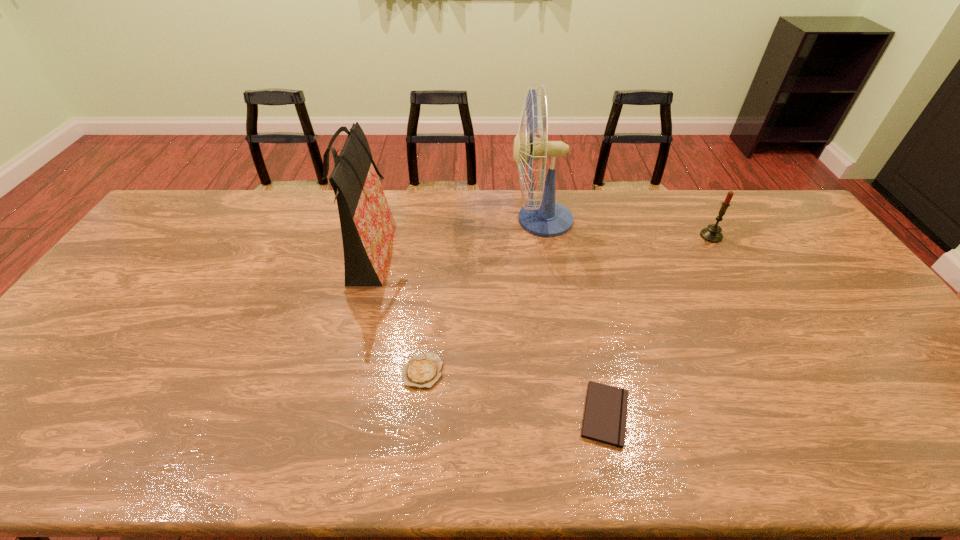
This screenshot has width=960, height=540. In order to click on unoccupied position between the rightmost object and the fan in this screenshot , I will do `click(626, 228)`.

Select which object is the second closest to the candle. Please provide its 2D coordinates. Your answer should be formatted as a tuple, i.e. [(x, y)], where the tuple contains the x and y coordinates of a point satisfying the conditions above.

[(605, 415)]

Locate which object is the second closest to the third shortest object. Please provide its 2D coordinates. Your answer should be formatted as a tuple, i.e. [(x, y)], where the tuple contains the x and y coordinates of a point satisfying the conditions above.

[(605, 415)]

At what (x,y) coordinates should I click in order to perform the action: click on free spot that satisfies the following two spatial constraints: 1. on the front side of the quiche; 2. on the left side of the leftmost object. Please return your answer as a coordinate pair (x, y). Looking at the image, I should click on (339, 371).

You are a GUI agent. You are given a task and a screenshot of the screen. Output one action in this format:
    pyautogui.click(x=<x>, y=<y>)
    Task: Click on the free location that satisfies the following two spatial constraints: 1. at the front of the fan where the blades are visible; 2. on the back side of the candle
    
    Given the screenshot: What is the action you would take?
    [x=544, y=236]

You are a GUI agent. You are given a task and a screenshot of the screen. Output one action in this format:
    pyautogui.click(x=<x>, y=<y>)
    Task: Click on the free space that satisfies the following two spatial constraints: 1. on the back side of the checkbook; 2. on the front side of the leftmost object
    The height and width of the screenshot is (540, 960).
    Given the screenshot: What is the action you would take?
    pyautogui.click(x=570, y=257)

This screenshot has height=540, width=960. I want to click on free space that satisfies the following two spatial constraints: 1. at the front of the fan where the blades are visible; 2. on the right side of the rightmost object, so click(544, 236).

The width and height of the screenshot is (960, 540). Identify the location of free spot that satisfies the following two spatial constraints: 1. at the front of the fan where the blades are visible; 2. on the left side of the checkbook. (572, 414).

Find the location of a particular element. free point that satisfies the following two spatial constraints: 1. on the front side of the leftmost object; 2. on the left side of the quiche is located at coordinates (339, 371).

Identify the location of free space that satisfies the following two spatial constraints: 1. on the front side of the checkbook; 2. on the left side of the shopping bag. The height and width of the screenshot is (540, 960). (327, 414).